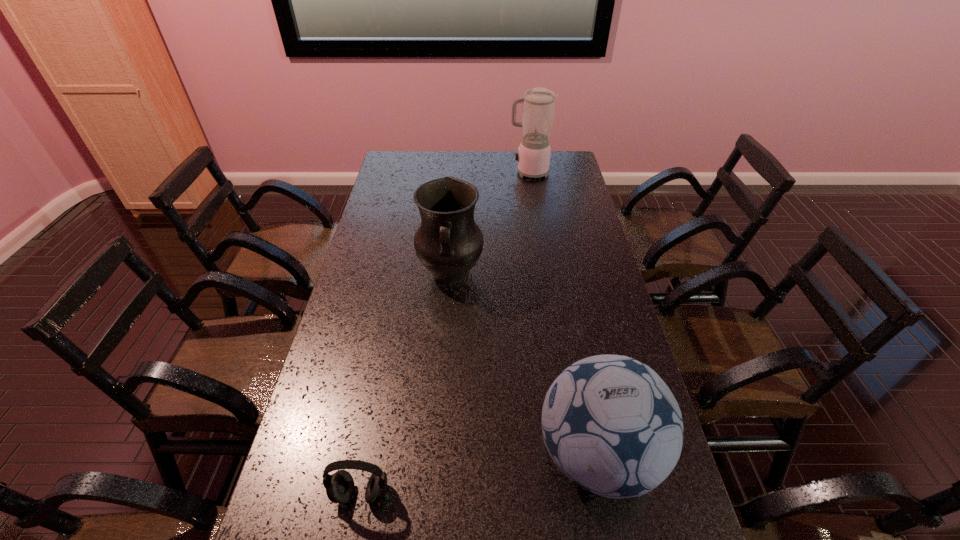
I want to click on vacant region located 0.290m on the side with brand of the soccer ball, so click(x=414, y=455).

I want to click on vacant point located on the side with brand of the soccer ball, so click(409, 455).

Where is `object present at the far edge`? object present at the far edge is located at coordinates (533, 157).

The image size is (960, 540). I want to click on object located in the left edge section of the desktop, so click(340, 486).

At what (x,y) coordinates should I click in order to perform the action: click on food processor at the right edge. Please return your answer as a coordinate pair (x, y). This screenshot has height=540, width=960. Looking at the image, I should click on (533, 157).

The height and width of the screenshot is (540, 960). I want to click on soccer ball present at the right edge, so click(x=610, y=423).

Where is `object that is positioned at the far right corner`? object that is positioned at the far right corner is located at coordinates (533, 157).

In the image, there is a desktop. At what (x,y) coordinates should I click in order to perform the action: click on vacant space at the far edge. Please return your answer as a coordinate pair (x, y). Looking at the image, I should click on (498, 152).

Where is `free location at the left edge`? free location at the left edge is located at coordinates (367, 283).

Locate an element on the screen. blank space at the right edge of the desktop is located at coordinates (584, 267).